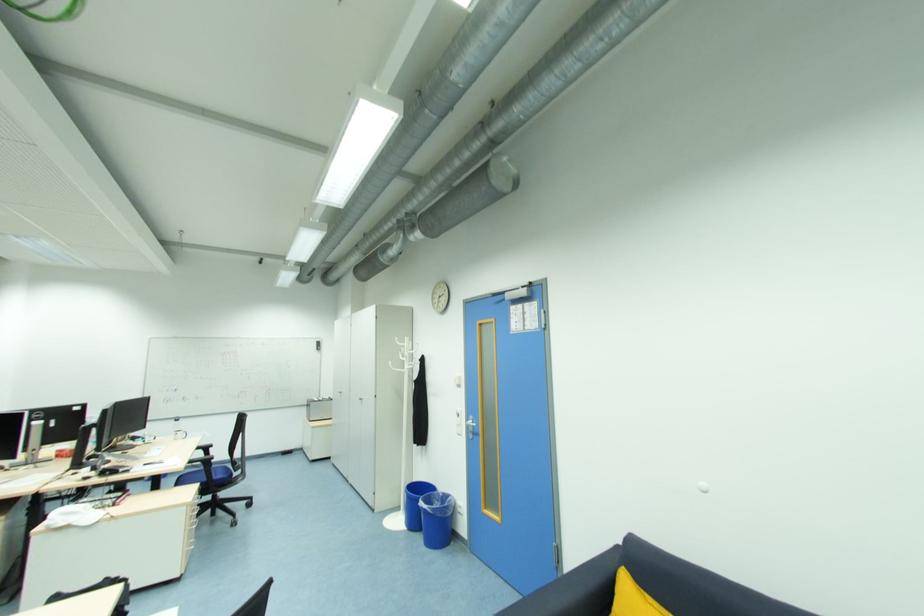
Find where to pull the silver door handle. Please return your answer as a coordinate pair (x, y).

(469, 427)